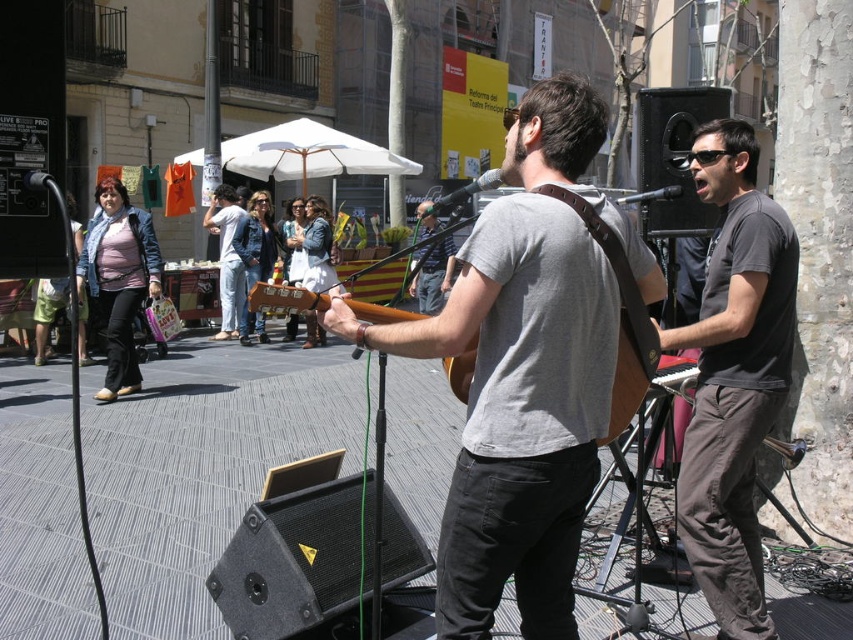
You are a photographer trying to capture the performer wearing the dark gray t shirt at center. You notice a point at coordinates (733, 376). Is this point located on the performer wearing the dark gray t shirt at center?

Yes, the point (733, 376) is on the dark gray t shirt at center, so it is located on the performer wearing the dark gray t shirt at center.